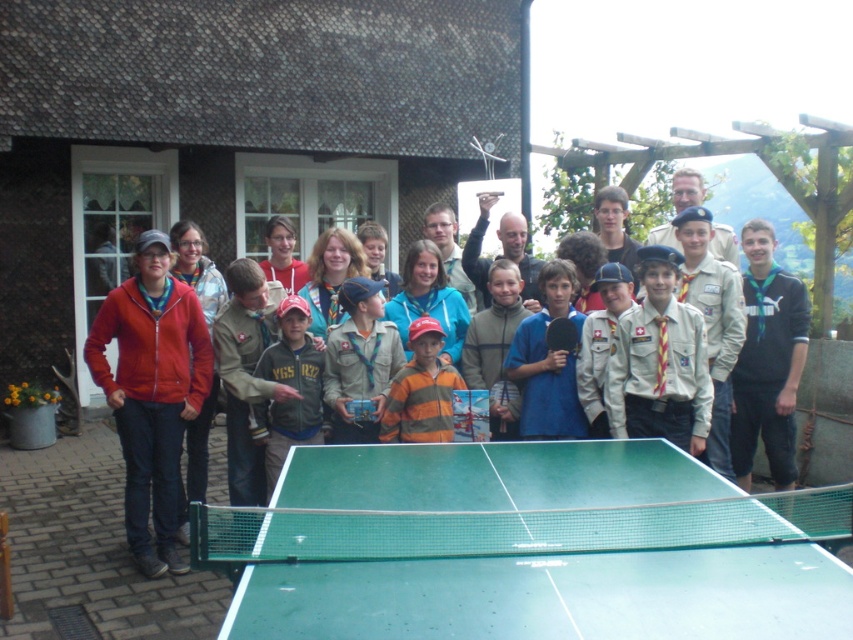
You are a photographer trying to capture a photo of the matte khaki uniform at center and the green rubber table tennis racket at center. You want to arrange them so that the uniform is to the right of the racket. Based on the current arrangement, should you move the uniform to the right or the racket to the left?

The matte khaki uniform at center is currently to the left of the green rubber table tennis racket at center. To achieve the desired arrangement where the uniform is to the right of the racket, you should move the racket to the left.

You are a photographer standing behind the group of people in front of the thatched roof building. You want to take a photo that clearly shows both the matte khaki uniform at center and the green rubber table tennis racket at center. Which object will appear larger in your photo?

The matte khaki uniform at center will appear larger in the photo because it is closer to the viewer than the green rubber table tennis racket at center.